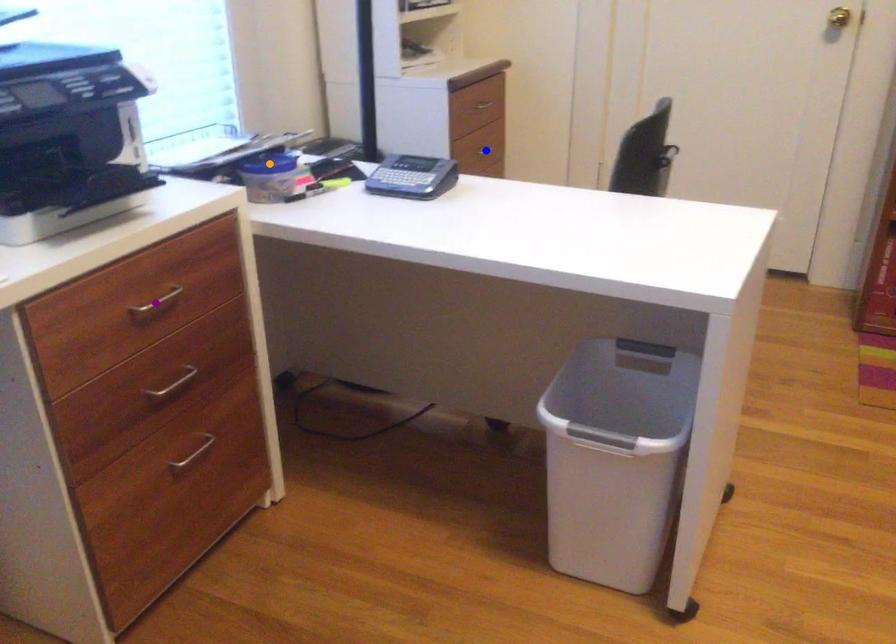
Order these from nearest to farthest:
1. orange point
2. purple point
3. blue point

1. purple point
2. orange point
3. blue point